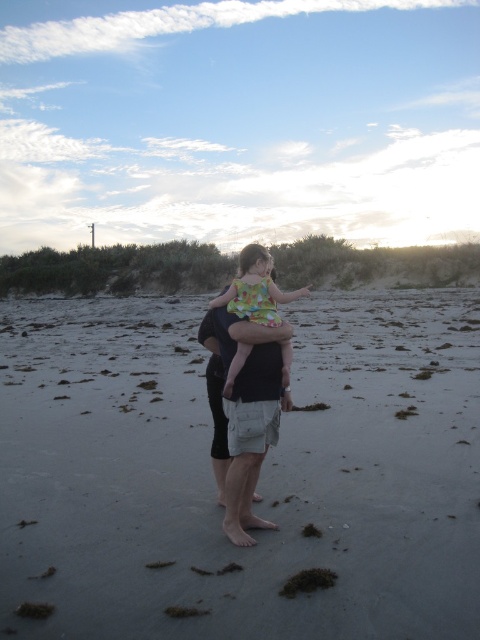
You are standing on the beach and notice a spot marked by a point at coordinates (259, 481). What is the color of the sand at that location?

The sand at the point marked by coordinates (259, 481) is gray in color.

You are a photographer trying to capture the man in the dark gray shorts at center and the woman in the floral fabric dress at center. Since you want both subjects to be clearly visible in the photo, which subject should you focus on first to ensure proper depth of field?

The dark gray shorts at center should be focused on first because the floral fabric dress at center is behind it, so focusing on the closer subject will ensure both are in focus.

You are a photographer trying to capture the perfect shot of the beach scene. You notice the gray sand at center and the dark gray shorts at center. Which object is higher in the image?

The gray sand at center is taller than the dark gray shorts at center, so the gray sand at center is higher in the image.